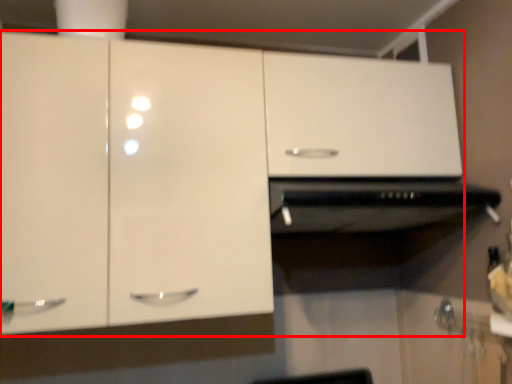
Question: From the image's perspective, considering the relative positions of cabinetry (annotated by the red box) and vent in the image provided, where is cabinetry (annotated by the red box) located with respect to the staircase?

Choices:
 (A) above
 (B) below

Answer: (A)